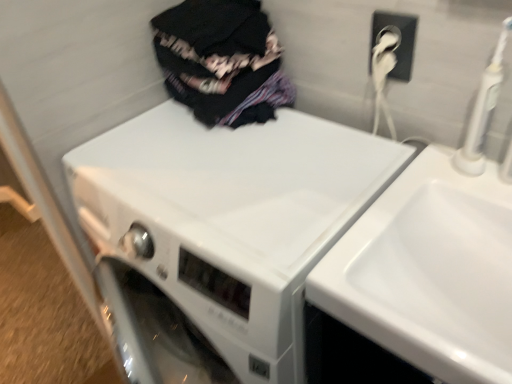
Measure the distance between white glossy washing machine at center and camera.

59.49 centimeters.

At what (x,y) coordinates should I click in order to perform the action: click on white glossy washing machine at center. Please return your answer as a coordinate pair (x, y). Looking at the image, I should click on (219, 235).

Between point (207, 48) and point (337, 258), which one is positioned in front?

The point (337, 258) is in front.

Can you see dark fabric clothes at upper center touching white glossy sink at upper right?

They are not placed beside each other.

Is dark fabric clothes at upper center looking in the opposite direction of white glossy sink at upper right?

dark fabric clothes at upper center does not have its back to white glossy sink at upper right.

From the image's perspective, is white glossy sink at upper right located above or below white plastic electric outlet at upper right?

Based on their image positions, white glossy sink at upper right is located beneath white plastic electric outlet at upper right.

From a real-world perspective, does white glossy sink at upper right sit lower than white plastic electric outlet at upper right?

Yes, from a real-world perspective, white glossy sink at upper right is beneath white plastic electric outlet at upper right.

Would you consider white glossy sink at upper right to be distant from white plastic electric outlet at upper right?

white glossy sink at upper right is near white plastic electric outlet at upper right, not far away.

Is white plastic electric outlet at upper right in front of or behind white glossy washing machine at center in the image?

In the image, white plastic electric outlet at upper right appears behind white glossy washing machine at center.

Is white plastic electric outlet at upper right outside of white glossy washing machine at center?

white plastic electric outlet at upper right lies outside white glossy washing machine at center's area.

Which of these two, white plastic electric outlet at upper right or white glossy washing machine at center, stands shorter?

Standing shorter between the two is white plastic electric outlet at upper right.

Which is behind, point (393, 23) or point (309, 120)?

The point (309, 120) is behind.

Based on the photo, considering their positions, is dark fabric clothes at upper center located in front of or behind white glossy washing machine at center?

In the image, dark fabric clothes at upper center appears behind white glossy washing machine at center.

Is dark fabric clothes at upper center bigger or smaller than white glossy washing machine at center?

In the image, dark fabric clothes at upper center appears to be smaller than white glossy washing machine at center.

Which object is wider, dark fabric clothes at upper center or white glossy washing machine at center?

white glossy washing machine at center.

Find the location of a particular element. This screenshot has width=512, height=384. clothing above the white glossy washing machine at center (from the image's perspective) is located at coordinates (222, 61).

Does white glossy washing machine at center come behind white glossy sink at upper right?

Yes.

From a real-world perspective, between white glossy washing machine at center and white glossy sink at upper right, who is vertically lower?

white glossy washing machine at center is physically lower.

From the picture: Is white glossy washing machine at center thinner than white glossy sink at upper right?

No.

Is white glossy washing machine at center to the left or to the right of white glossy sink at upper right in the image?

Clearly, white glossy washing machine at center is on the left of white glossy sink at upper right in the image.

From the image's perspective, does white plastic electric outlet at upper right appear lower than dark fabric clothes at upper center?

Correct, white plastic electric outlet at upper right appears lower than dark fabric clothes at upper center in the image.

Is white plastic electric outlet at upper right in front of dark fabric clothes at upper center?

Yes.

Considering the sizes of objects white plastic electric outlet at upper right and dark fabric clothes at upper center in the image provided, who is bigger, white plastic electric outlet at upper right or dark fabric clothes at upper center?

dark fabric clothes at upper center is bigger.

Which of these two, white plastic electric outlet at upper right or dark fabric clothes at upper center, is wider?

dark fabric clothes at upper center is wider.

Which object is further away from the camera, dark fabric clothes at upper center or white plastic electric outlet at upper right?

Result: dark fabric clothes at upper center is behind.

Are dark fabric clothes at upper center and white plastic electric outlet at upper right far apart?

They are positioned close to each other.

Which of these two, dark fabric clothes at upper center or white plastic electric outlet at upper right, stands shorter?

With less height is white plastic electric outlet at upper right.

Is dark fabric clothes at upper center facing away from white plastic electric outlet at upper right?

No, dark fabric clothes at upper center is not facing away from white plastic electric outlet at upper right.

Identify the location of sink below the dark fabric clothes at upper center (from a real-world perspective). The image size is (512, 384). (429, 272).

Find the location of `electric outlet above the white glossy sink at upper right (from the image's perspective)`. electric outlet above the white glossy sink at upper right (from the image's perspective) is located at coordinates tap(398, 41).

Which object lies nearer to the anchor point white plastic electric outlet at upper right, white glossy sink at upper right or white glossy washing machine at center?

white glossy sink at upper right is closer to white plastic electric outlet at upper right.

Based on the photo, based on their spatial positions, is dark fabric clothes at upper center or white glossy washing machine at center further from white plastic electric outlet at upper right?

Based on the image, white glossy washing machine at center appears to be further to white plastic electric outlet at upper right.

Which object lies nearer to the anchor point dark fabric clothes at upper center, white glossy washing machine at center or white glossy sink at upper right?

white glossy washing machine at center lies closer to dark fabric clothes at upper center than the other object.

Considering their positions, is white glossy washing machine at center positioned closer to white plastic electric outlet at upper right than white glossy sink at upper right?

Based on the image, white glossy sink at upper right appears to be nearer to white plastic electric outlet at upper right.

Estimate the real-world distances between objects in this image. Which object is closer to white glossy washing machine at center, white plastic electric outlet at upper right or white glossy sink at upper right?

Based on the image, white glossy sink at upper right appears to be nearer to white glossy washing machine at center.

From the image, which object appears to be nearer to white glossy sink at upper right, white glossy washing machine at center or dark fabric clothes at upper center?

white glossy washing machine at center is closer to white glossy sink at upper right.

Which object lies further to the anchor point dark fabric clothes at upper center, white plastic electric outlet at upper right or white glossy washing machine at center?

white plastic electric outlet at upper right is further to dark fabric clothes at upper center.

Considering their positions, is white glossy sink at upper right positioned closer to white glossy washing machine at center than dark fabric clothes at upper center?

white glossy sink at upper right is positioned closer to the anchor white glossy washing machine at center.

The image size is (512, 384). I want to click on electric outlet between dark fabric clothes at upper center and white glossy sink at upper right from top to bottom, so click(x=398, y=41).

I want to click on sink between dark fabric clothes at upper center and white glossy washing machine at center in the vertical direction, so click(429, 272).

Locate an element on the screen. sink between white plastic electric outlet at upper right and white glossy washing machine at center vertically is located at coordinates (429, 272).

Locate an element on the screen. The width and height of the screenshot is (512, 384). electric outlet that lies between dark fabric clothes at upper center and white glossy washing machine at center from top to bottom is located at coordinates (398, 41).